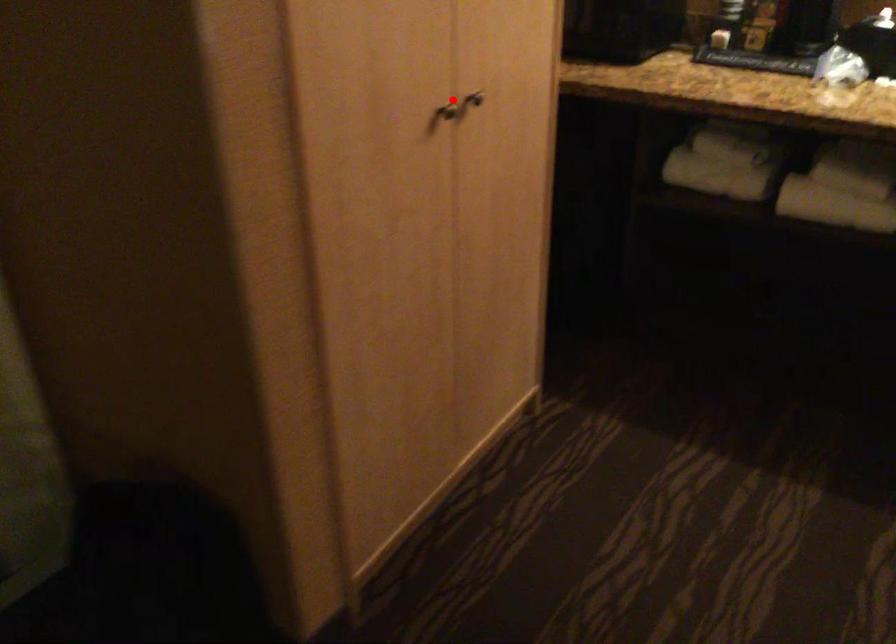
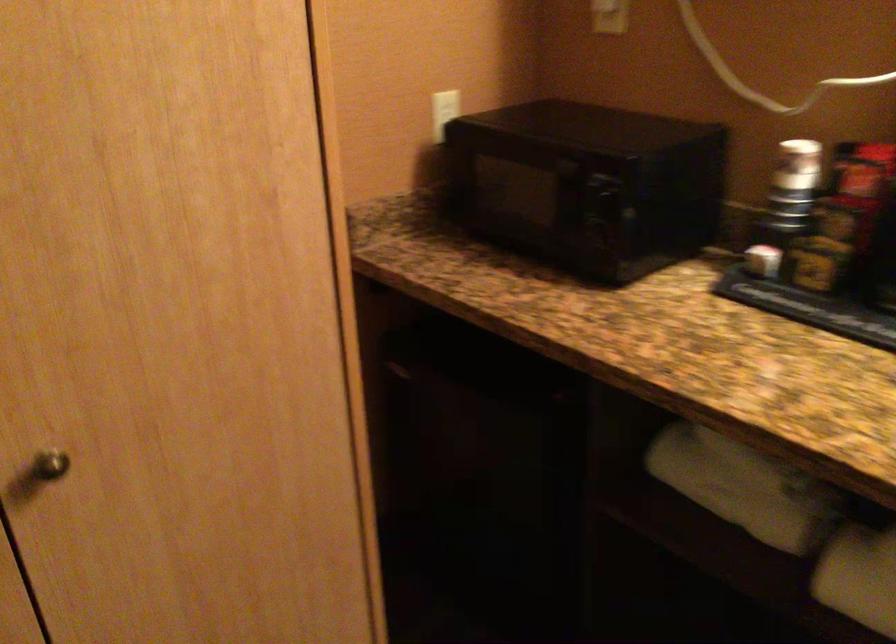
Question: A red point is marked in image1. In image2, is the corresponding 3D point closer to the camera or farther? Reply with the corresponding letter.

Choices:
 (A) The corresponding 3D point is closer.
 (B) The corresponding 3D point is farther.

Answer: (A)